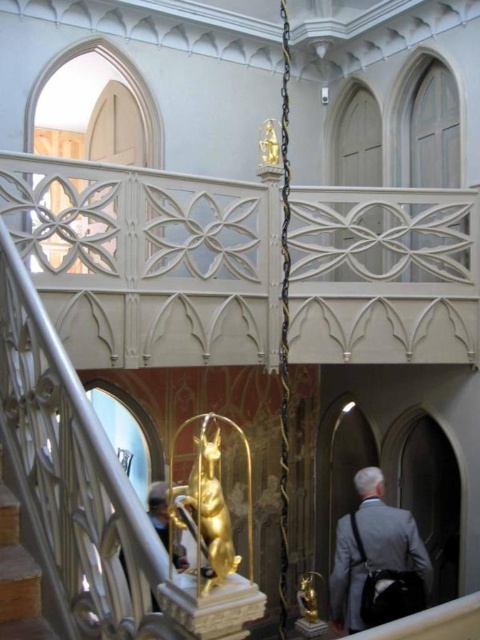
You are organizing a charity event in this Gothic Revival styled room and need to place a large banner between the gray fabric coat at lower right and the wooden at lower left. Which object should you place the banner closer to to ensure it doesn not block the staircase entrance?

The gray fabric coat at lower right has a larger width than the wooden at lower left. To avoid blocking the staircase entrance, place the banner closer to the gray fabric coat at lower right since it occupies more space.